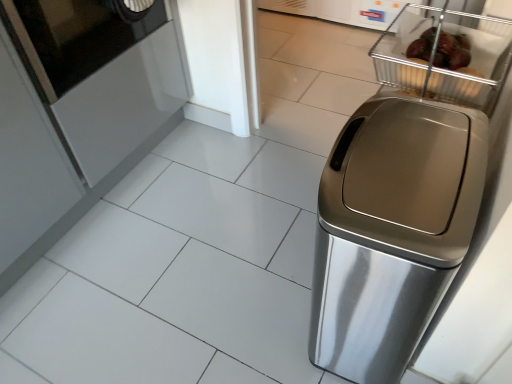
Question: Visually, is metallic wire basket at upper right positioned to the left or to the right of satin silver trash can at right?

Choices:
 (A) right
 (B) left

Answer: (A)

Question: Is point pos(509,56) positioned closer to the camera than point pos(437,271)?

Choices:
 (A) farther
 (B) closer

Answer: (A)

Question: Based on their relative distances, which object is nearer to the black glass screen door at upper left?

Choices:
 (A) metallic wire basket at upper right
 (B) satin silver trash can at right

Answer: (A)

Question: Estimate the real-world distances between objects in this image. Which object is farther from the metallic wire basket at upper right?

Choices:
 (A) satin silver trash can at right
 (B) black glass screen door at upper left

Answer: (B)